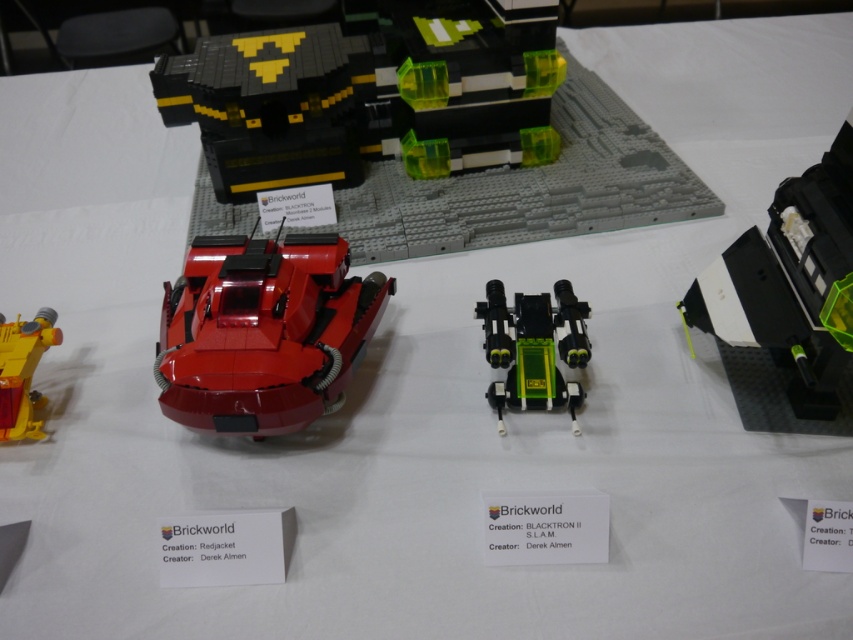
Is the position of black matte/black plastic building at upper center more distant than that of shiny red car at center?

Yes, it is.

Looking at this image, is black matte/black plastic building at upper center smaller than shiny red car at center?

No.

Does point (273, 33) come farther from viewer compared to point (281, 278)?

Yes.

Where is `black matte/black plastic building at upper center`? black matte/black plastic building at upper center is located at coordinates (364, 90).

Is black matte/black plastic building at upper center thinner than green matte/transparent plastic tank at center?

In fact, black matte/black plastic building at upper center might be wider than green matte/transparent plastic tank at center.

Does black matte/black plastic building at upper center have a greater height compared to green matte/transparent plastic tank at center?

Yes, black matte/black plastic building at upper center is taller than green matte/transparent plastic tank at center.

Which is behind, point (337, 138) or point (567, 323)?

Point (337, 138)

Locate an element on the screen. The image size is (853, 640). black matte/black plastic building at upper center is located at coordinates (364, 90).

Which is behind, point (781, 234) or point (10, 339)?

Positioned behind is point (10, 339).

Is black matte/transparent plastic at right smaller than yellow plastic helicopter at left?

Actually, black matte/transparent plastic at right might be larger than yellow plastic helicopter at left.

Between point (810, 307) and point (32, 404), which one is positioned in front?

Positioned in front is point (810, 307).

Identify the location of black matte/transparent plastic at right. (785, 304).